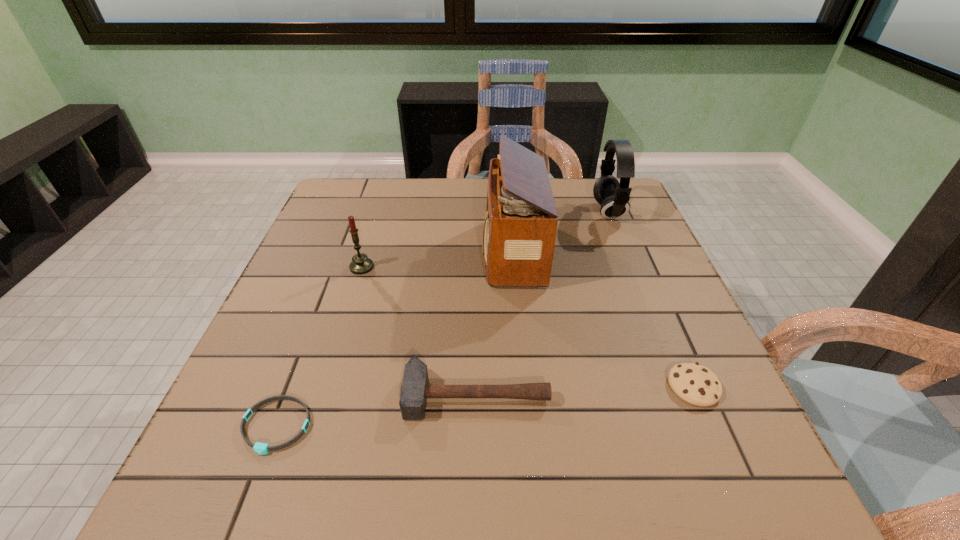
The height and width of the screenshot is (540, 960). Find the location of `free location located on the ear cups of the earphone`. free location located on the ear cups of the earphone is located at coordinates (510, 211).

The height and width of the screenshot is (540, 960). I want to click on free point located on the ear cups of the earphone, so click(489, 211).

This screenshot has width=960, height=540. I want to click on free space located on the back of the candle, so click(374, 225).

This screenshot has width=960, height=540. I want to click on free space located on the striking surface of the third shortest object, so click(475, 506).

Find the location of a particular element. Image resolution: width=960 pixels, height=540 pixels. blank area located on the back of the cookie is located at coordinates (652, 292).

This screenshot has height=540, width=960. Find the location of `radio receiver located at the far edge`. radio receiver located at the far edge is located at coordinates (520, 227).

Find the location of `earphone located in the far edge section of the desktop`. earphone located in the far edge section of the desktop is located at coordinates (614, 197).

You are a GUI agent. You are given a task and a screenshot of the screen. Output one action in this format:
    pyautogui.click(x=<x>, y=<y>)
    Task: Click on the object that is at the near edge
    The width and height of the screenshot is (960, 540).
    Given the screenshot: What is the action you would take?
    pyautogui.click(x=260, y=448)

Where is `candle positioned at the left edge`? This screenshot has height=540, width=960. candle positioned at the left edge is located at coordinates (361, 264).

What are the coordinates of `wristband at the left edge` in the screenshot? It's located at (260, 448).